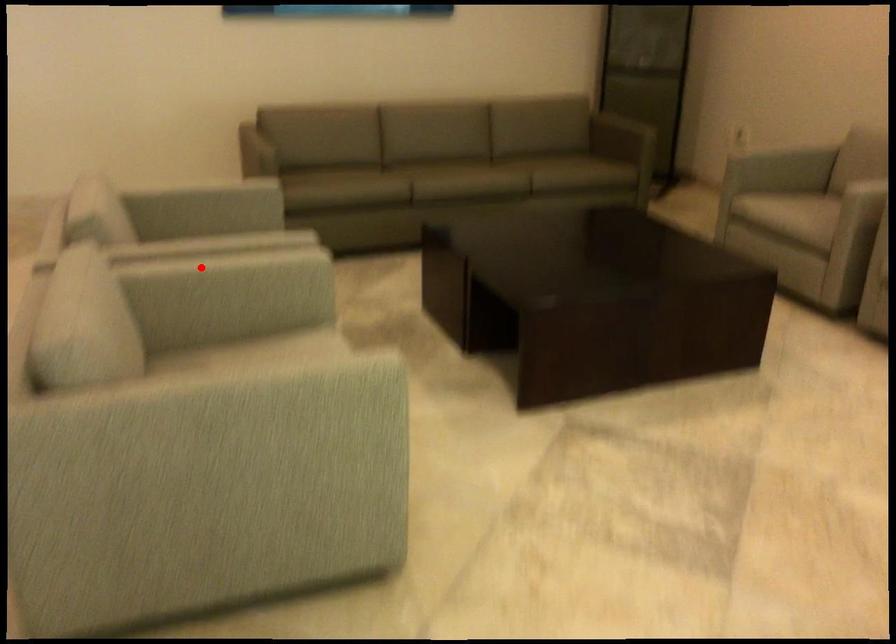
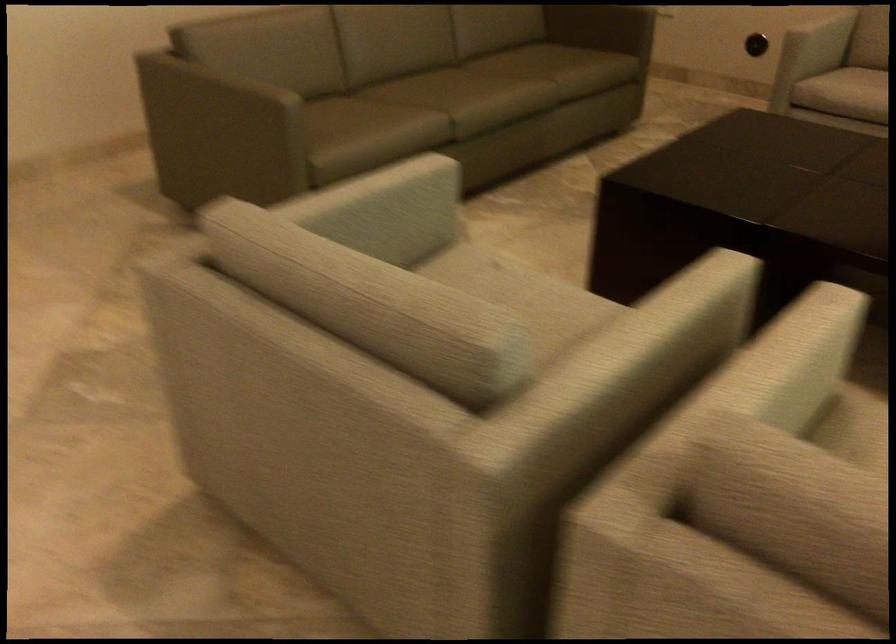
The point at the highlighted location is marked in the first image. Where is the corresponding point in the second image?

(782, 366)